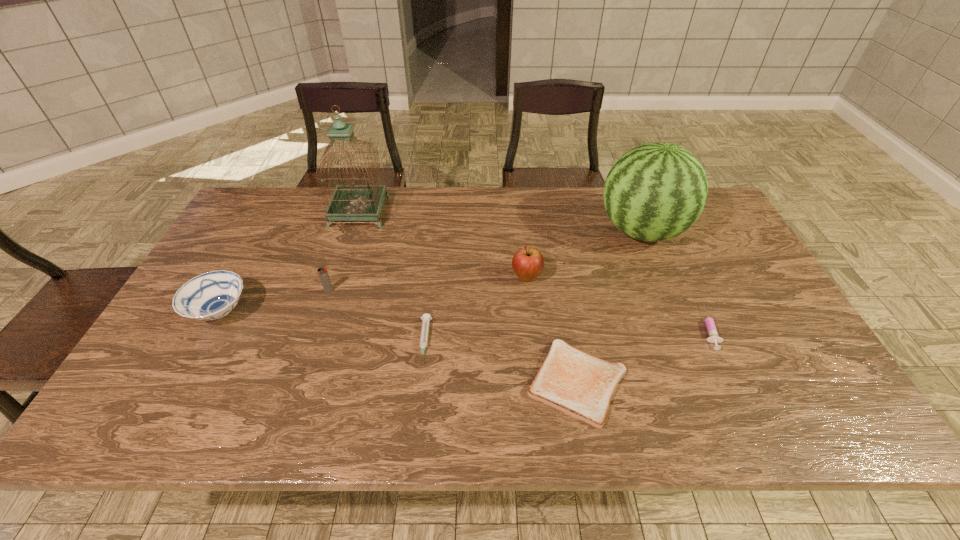
Locate an element on the screen. The width and height of the screenshot is (960, 540). vacant space that is in between the shortest object and the fourth object from left to right is located at coordinates click(501, 362).

This screenshot has height=540, width=960. I want to click on vacant area that lies between the fourth object from left to right and the igniter, so click(x=376, y=316).

Locate an element on the screen. blank region between the watermelon and the birdcage is located at coordinates (500, 221).

Identify the location of empty location between the third tallest object and the birdcage. Image resolution: width=960 pixels, height=540 pixels. (443, 244).

I want to click on blank region between the shortest object and the third tallest object, so click(x=552, y=330).

What are the coordinates of `free space between the birdcage and the sixth nearest object` in the screenshot? It's located at (443, 244).

I want to click on the second closest object relative to the shortest object, so click(710, 324).

This screenshot has height=540, width=960. What are the coordinates of `object that ranks as the second closest to the fifth object from right to left` in the screenshot? It's located at (527, 263).

Locate an element on the screen. Image resolution: width=960 pixels, height=540 pixels. vacant area in the image that satisfies the following two spatial constraints: 1. at the door of the sixth nearest object; 2. on the right side of the birdcage is located at coordinates (338, 277).

This screenshot has width=960, height=540. I want to click on vacant space that satisfies the following two spatial constraints: 1. on the back side of the right syringe; 2. at the door of the birdcage, so click(x=653, y=212).